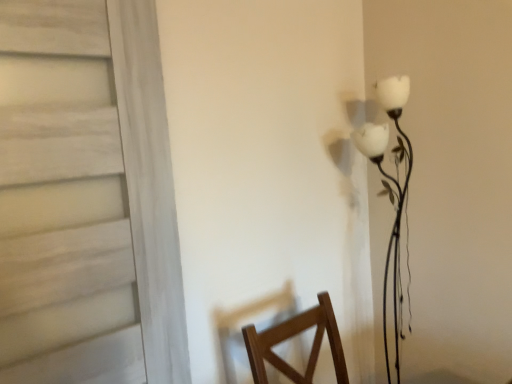
Question: In the image, is white wood door at left positioned in front of or behind white matte floral lamp at right?

Choices:
 (A) behind
 (B) front

Answer: (B)

Question: In terms of size, does white wood door at left appear bigger or smaller than white matte floral lamp at right?

Choices:
 (A) small
 (B) big

Answer: (B)

Question: Is white wood door at left wider or thinner than white matte floral lamp at right?

Choices:
 (A) thin
 (B) wide

Answer: (A)

Question: Considering the positions of white matte floral lamp at right and white wood door at left in the image, is white matte floral lamp at right taller or shorter than white wood door at left?

Choices:
 (A) short
 (B) tall

Answer: (B)

Question: Considering the positions of white matte floral lamp at right and white wood door at left in the image, is white matte floral lamp at right wider or thinner than white wood door at left?

Choices:
 (A) wide
 (B) thin

Answer: (A)

Question: Relative to white wood door at left, is white matte floral lamp at right in front or behind?

Choices:
 (A) behind
 (B) front

Answer: (A)

Question: Considering the relative positions of white matte floral lamp at right and white wood door at left in the image provided, is white matte floral lamp at right to the left or to the right of white wood door at left?

Choices:
 (A) right
 (B) left

Answer: (A)